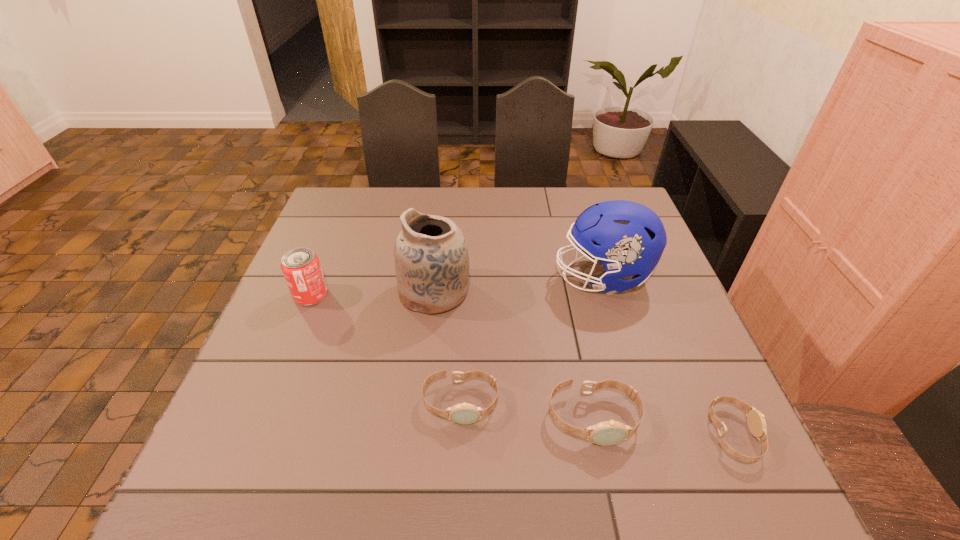
Locate an element on the screen. This screenshot has width=960, height=540. blank space located 0.320m on the face guard of the football helmet is located at coordinates (434, 276).

Where is `vacant point located 0.180m on the face guard of the football helmet`? vacant point located 0.180m on the face guard of the football helmet is located at coordinates (487, 276).

This screenshot has height=540, width=960. Identify the location of vacant area situated 0.210m on the right of the pottery. (552, 292).

Image resolution: width=960 pixels, height=540 pixels. Identify the location of free location located 0.350m on the back of the leftmost object. click(346, 210).

Identify the location of object at the left edge. (301, 268).

Locate an element on the screen. watch that is positioned at the right edge is located at coordinates (756, 422).

Where is `football helmet that is at the right edge`? The height and width of the screenshot is (540, 960). football helmet that is at the right edge is located at coordinates tap(627, 238).

Identify the location of object that is at the near right corner. The height and width of the screenshot is (540, 960). (756, 422).

In the image, there is a desktop. At what (x,y) coordinates should I click in order to perform the action: click on vacant space at the far edge. Please return your answer as a coordinate pair (x, y). The width and height of the screenshot is (960, 540). Looking at the image, I should click on (419, 195).

Locate an element on the screen. The width and height of the screenshot is (960, 540). vacant space at the near edge of the desktop is located at coordinates (588, 416).